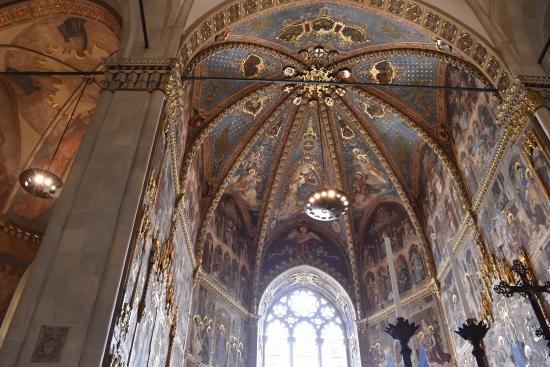
You are a GUI agent. You are given a task and a screenshot of the screen. Output one action in this format:
    pyautogui.click(x=<x>, y=<y>)
    Task: Click on the windows
    This screenshot has height=367, width=550.
    Given the screenshot: What is the action you would take?
    pyautogui.click(x=305, y=307), pyautogui.click(x=305, y=340), pyautogui.click(x=296, y=340), pyautogui.click(x=280, y=343), pyautogui.click(x=335, y=343)